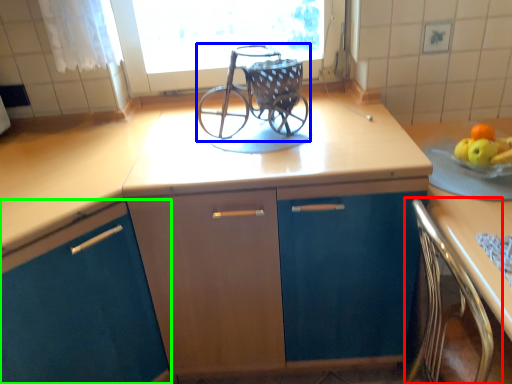
Question: Which object is the closest to the chair (highlighted by a red box)? Choose among these: baby carriage (highlighted by a blue box) or cabinetry (highlighted by a green box).

Choices:
 (A) baby carriage
 (B) cabinetry

Answer: (A)